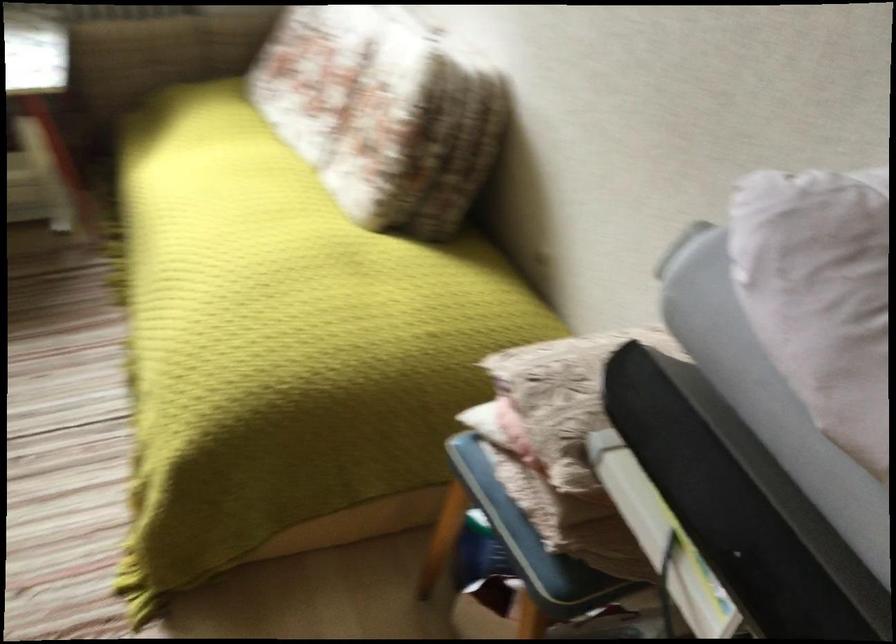
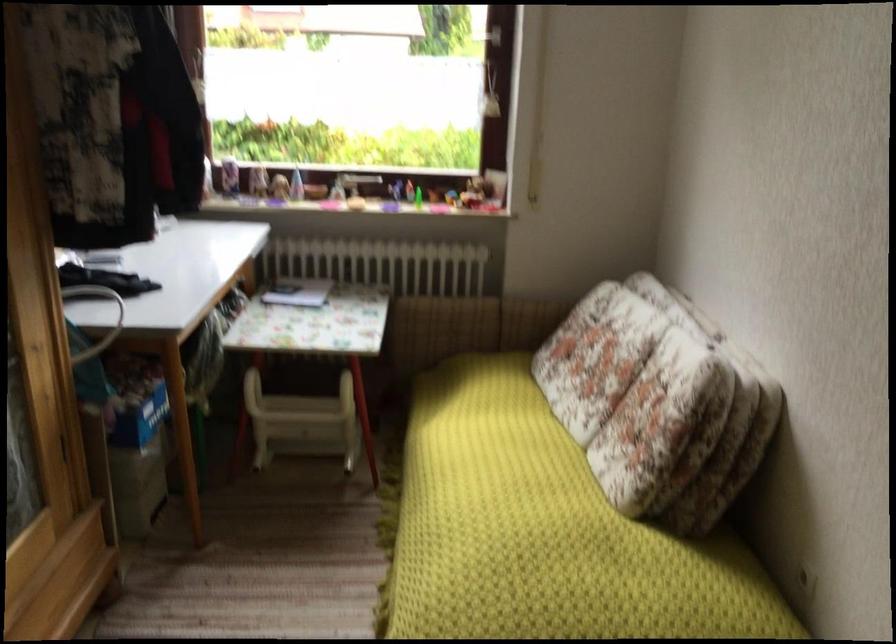
The point at (x=280, y=258) is marked in the first image. Where is the corresponding point in the second image?

(544, 532)